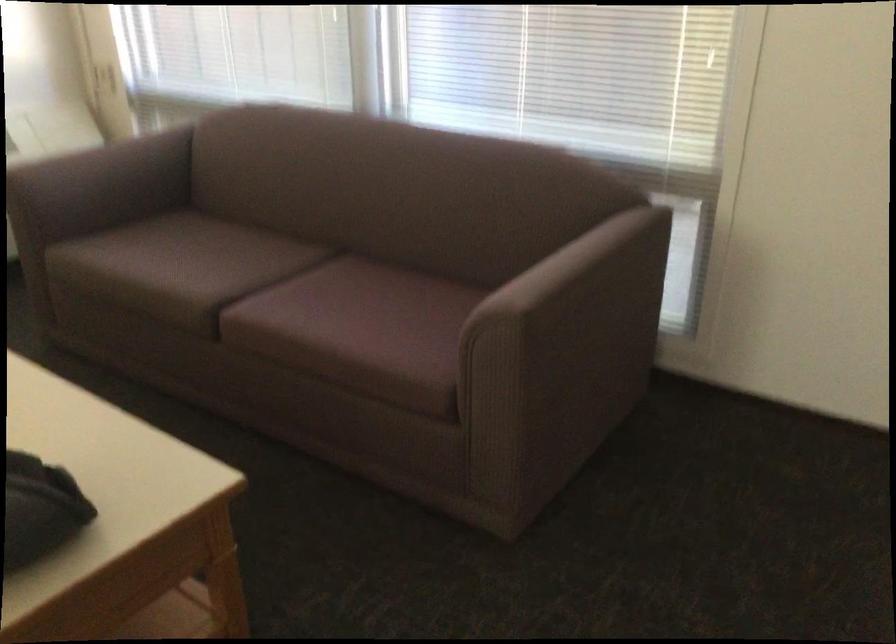
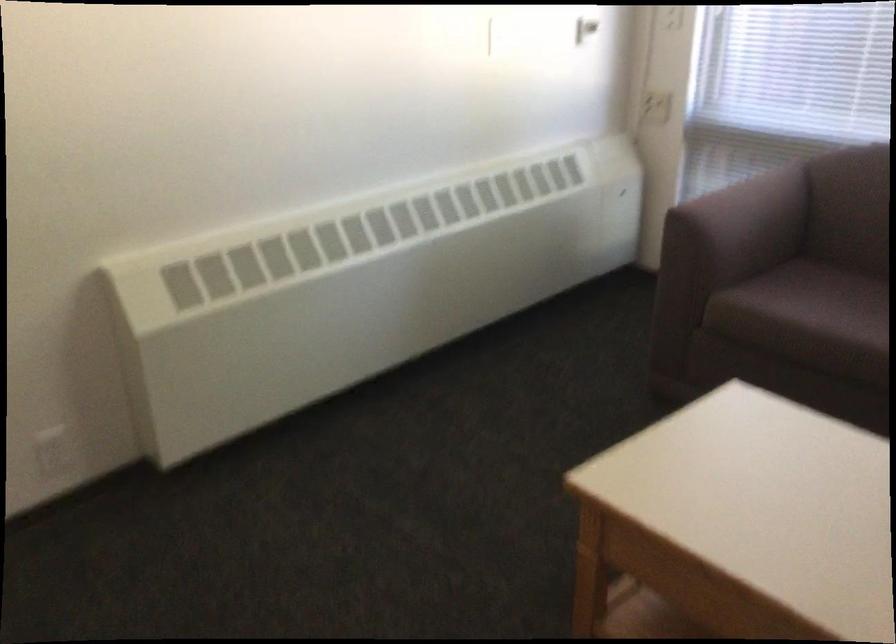
Find the pixel in the second image that matches point 130,247 in the first image.

(807, 303)